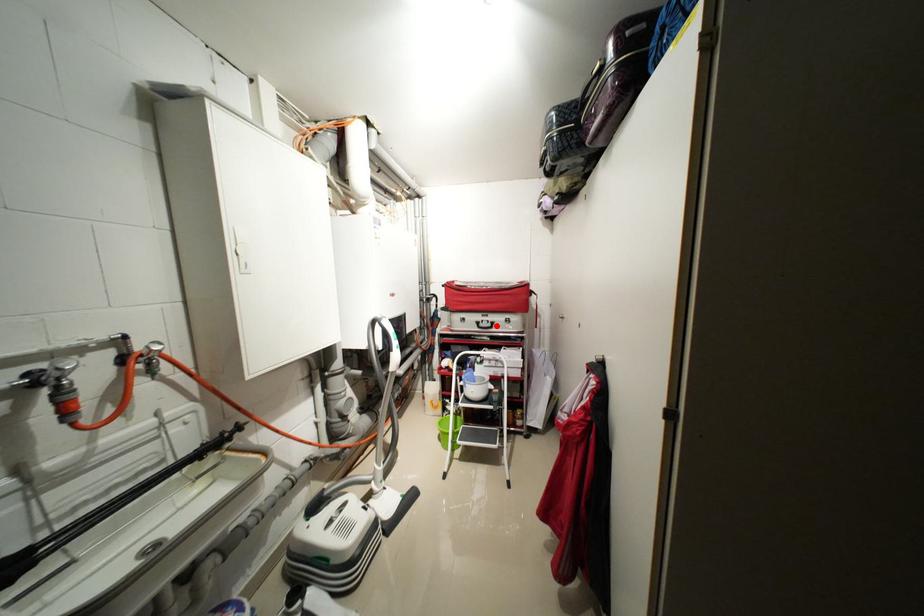
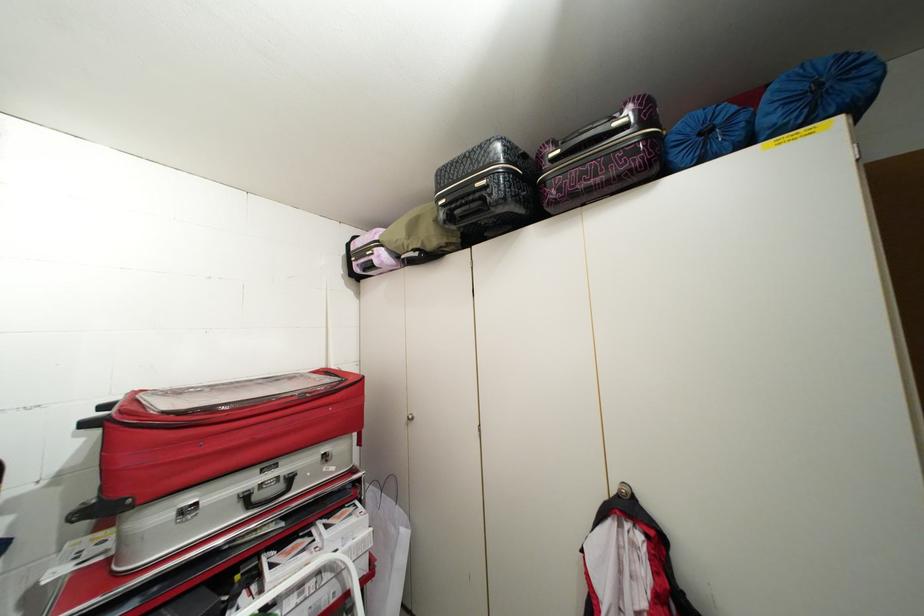
Locate, in the second image, the point that corresponds to the highlighted location in the first image.

(287, 487)